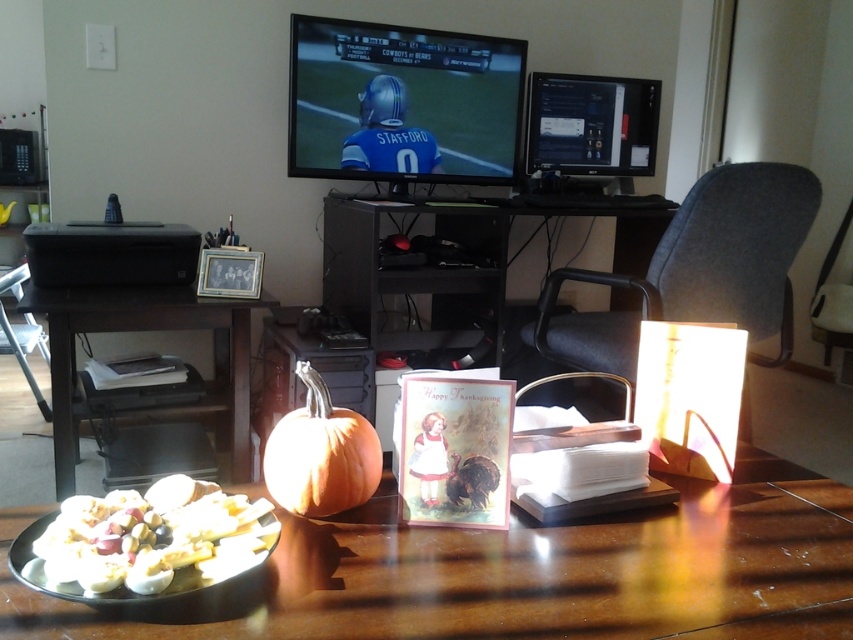
Does wooden table at center appear on the right side of black fabric chair at center?

No, wooden table at center is not to the right of black fabric chair at center.

Where is `wooden table at center`? The height and width of the screenshot is (640, 853). wooden table at center is located at coordinates (515, 573).

Identify the location of wooden table at center. (515, 573).

Is point (96, 588) farther from camera compared to point (299, 464)?

No, (96, 588) is closer to viewer.

Between point (241, 516) and point (350, 429), which one is positioned behind?

The point (350, 429) is behind.

Locate an element on the screen. white cheese at lower left is located at coordinates (154, 536).

Does point (582, 352) come closer to viewer compared to point (132, 324)?

That is False.

Who is positioned more to the left, black fabric chair at center or dark brown wood table at left?

Positioned to the left is dark brown wood table at left.

Find the location of a particular element. This screenshot has width=853, height=640. black fabric chair at center is located at coordinates (697, 269).